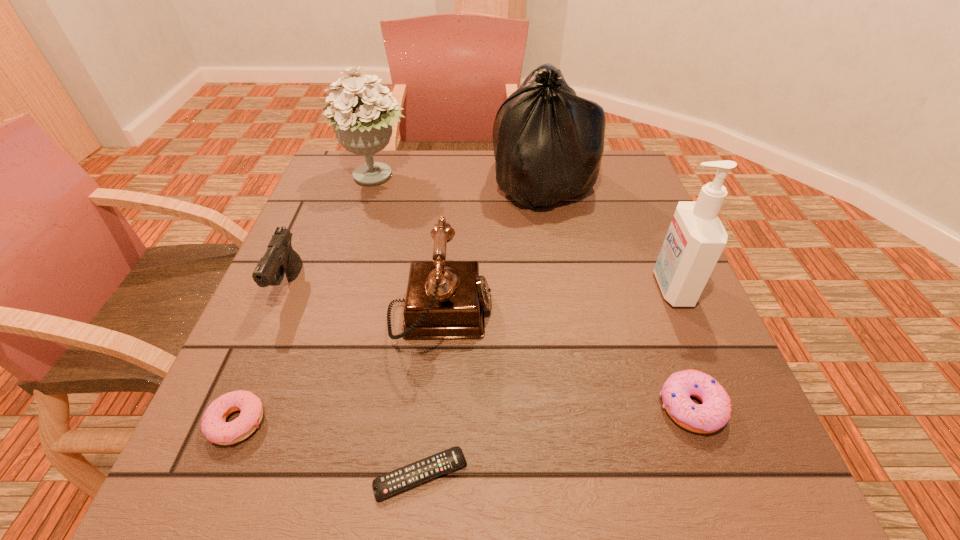
The height and width of the screenshot is (540, 960). Identify the location of plastic bag that is at the far edge. (548, 142).

The height and width of the screenshot is (540, 960). Find the location of `bouquet situated at the far edge`. bouquet situated at the far edge is located at coordinates (363, 122).

Find the location of `doughnut positioned at the near edge`. doughnut positioned at the near edge is located at coordinates (215, 428).

Where is `remote control located at the near edge`? This screenshot has width=960, height=540. remote control located at the near edge is located at coordinates (396, 481).

Find the location of `bouquet present at the left edge`. bouquet present at the left edge is located at coordinates (363, 122).

Locate an element on the screen. pistol at the left edge is located at coordinates (279, 259).

You are a GUI agent. You are given a task and a screenshot of the screen. Output one action in this format:
    pyautogui.click(x=<x>, y=<y>)
    Task: Click on the doughnut at the left edge
    This screenshot has height=540, width=960.
    Given the screenshot: What is the action you would take?
    pyautogui.click(x=215, y=428)

Locate an element on the screen. This screenshot has height=540, width=960. plastic bag located at the right edge is located at coordinates (548, 142).

Identify the location of cleansing agent present at the right edge. (696, 237).

Image resolution: width=960 pixels, height=540 pixels. I want to click on doughnut at the right edge, so click(x=714, y=412).